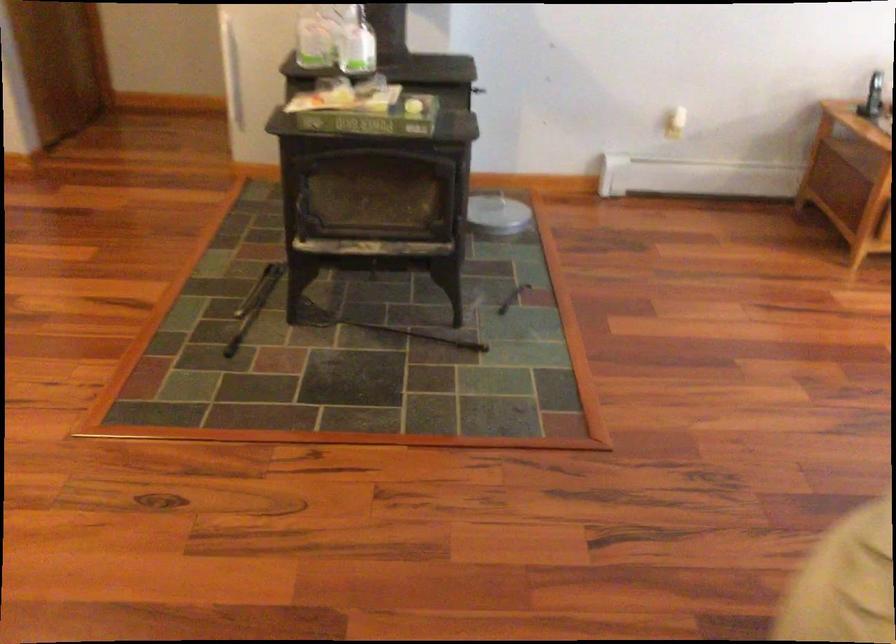
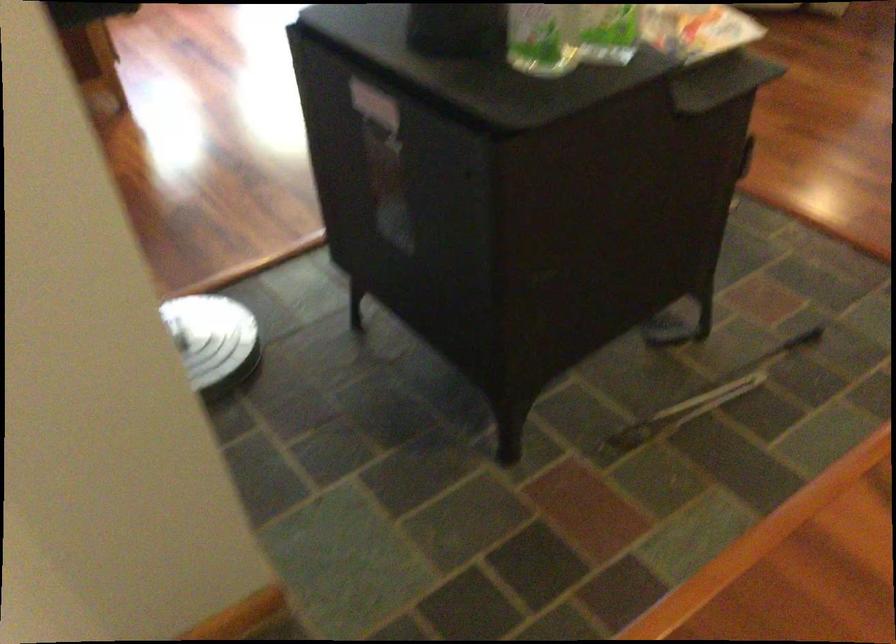
Question: I am providing you with two images of the same scene from different viewpoints. Please identify which objects are invisible in image2.

Choices:
 (A) black metal poker
 (B) green plastic bottle
 (C) grey back cushion
 (D) stove door handle

Answer: (A)